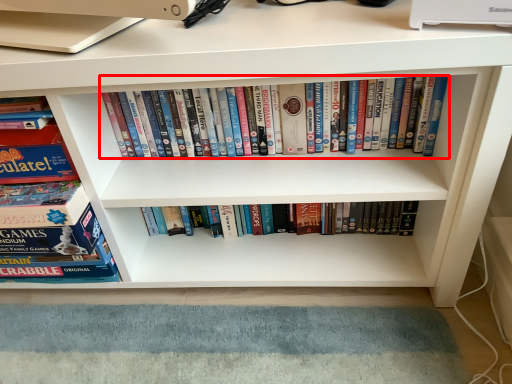
Question: From the image's perspective, what is the correct spatial relationship of book (annotated by the red box) in relation to book?

Choices:
 (A) above
 (B) below

Answer: (A)